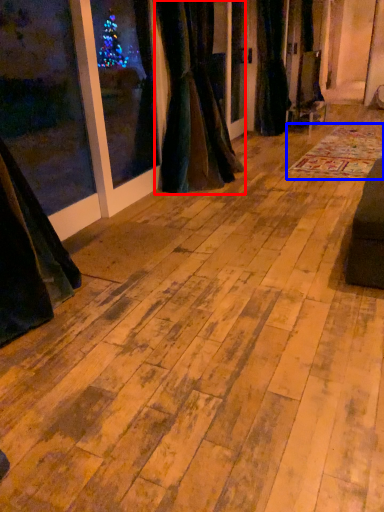
Question: Which object appears closest to the camera in this image, curtain (highlighted by a red box) or mat (highlighted by a blue box)?

Choices:
 (A) curtain
 (B) mat

Answer: (A)